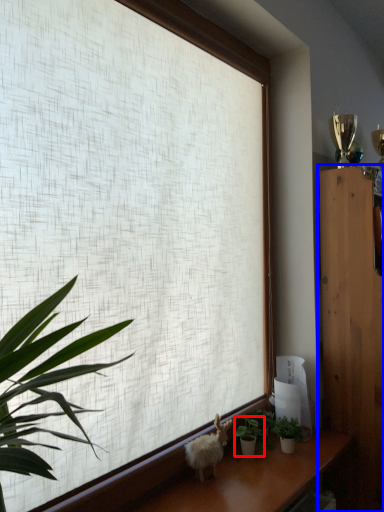
Question: Which of the following is the farthest to the observer, houseplant (highlighted by a red box) or furniture (highlighted by a blue box)?

Choices:
 (A) houseplant
 (B) furniture

Answer: (B)